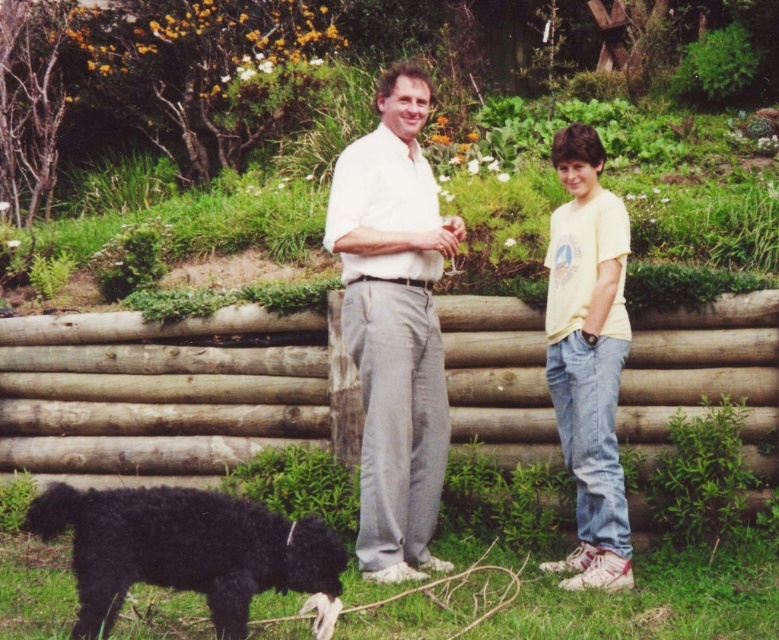
You are a photographer trying to capture a group photo of the black fuzzy dog at lower left and the yellow cotton shirt at right. Since you want both subjects to appear balanced in size, which subject should you move closer to the camera?

The yellow cotton shirt at right should be moved closer to the camera because the black fuzzy dog at lower left is wider, so bringing the smaller yellow cotton shirt at right closer will make them appear more balanced in size.

You are organizing a clothing donation drive and need to determine which shirt can fit into a storage box that has a width limit of 30 cm. Given the white cotton shirt at center and the yellow cotton shirt at right, which one is more likely to fit based on their widths?

The yellow cotton shirt at right has a smaller width compared to the white cotton shirt at center, so it is more likely to fit into the storage box with a 30 cm width limit.

You are a photographer trying to capture a photo of the black fuzzy dog at lower left without the white cotton shirt at center appearing in the frame. Based on their positions, is this possible?

The white cotton shirt at center is positioned on the right side of the black fuzzy dog at lower left, so if you move to the left side of the dog, the shirt should be out of the frame.